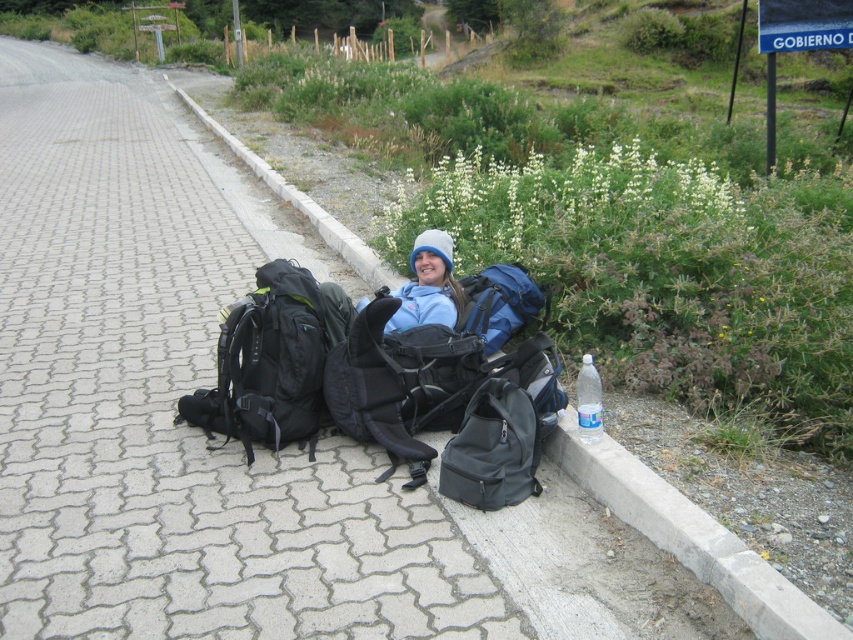
Can you confirm if concrete at lower center is smaller than black fabric backpack at center?

Actually, concrete at lower center might be larger than black fabric backpack at center.

Who is more distant from viewer, [216,120] or [267,392]?

The point [216,120] is behind.

The image size is (853, 640). What are the coordinates of `concrete at lower center` in the screenshot? It's located at (695, 538).

Can you confirm if paved stone pavement at center is positioned to the left of clear plastic bottle at lower right?

Correct, you'll find paved stone pavement at center to the left of clear plastic bottle at lower right.

Based on the photo, is paved stone pavement at center wider than clear plastic bottle at lower right?

Yes, paved stone pavement at center is wider than clear plastic bottle at lower right.

Does point (173, 132) come behind point (583, 381)?

Yes, it is.

In order to click on paved stone pavement at center in this screenshot , I will do `click(170, 406)`.

Is black fabric backpack at center taller than matte black backpack at lower center?

Yes, black fabric backpack at center is taller than matte black backpack at lower center.

Between point (277, 429) and point (498, 433), which one is positioned in front?

Point (498, 433)

Describe the element at coordinates (271, 360) in the screenshot. I see `black fabric backpack at center` at that location.

Find the location of a particular element. black fabric backpack at center is located at coordinates (271, 360).